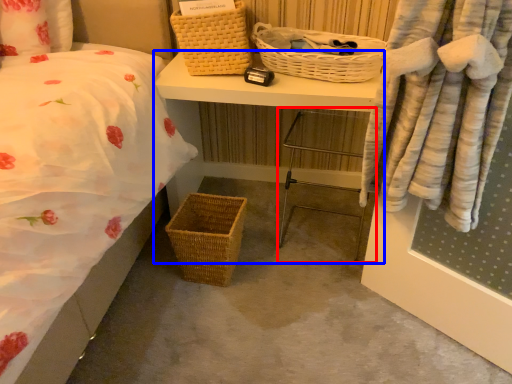
Question: Which of the following is the closest to the observer, chair (highlighted by a red box) or desk (highlighted by a blue box)?

Choices:
 (A) chair
 (B) desk

Answer: (A)